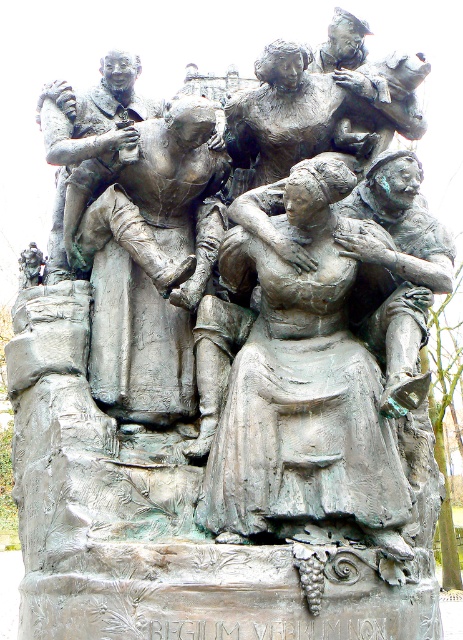
The image size is (463, 640). What are the coordinates of `bronze statue of woman at center` in the screenshot? It's located at (304, 385).

Is bronze statue of woman at center above bronze statue of man at center?

Actually, bronze statue of woman at center is below bronze statue of man at center.

At what (x,y) coordinates should I click in order to perform the action: click on bronze statue of woman at center. Please return your answer as a coordinate pair (x, y). The width and height of the screenshot is (463, 640). Looking at the image, I should click on (304, 385).